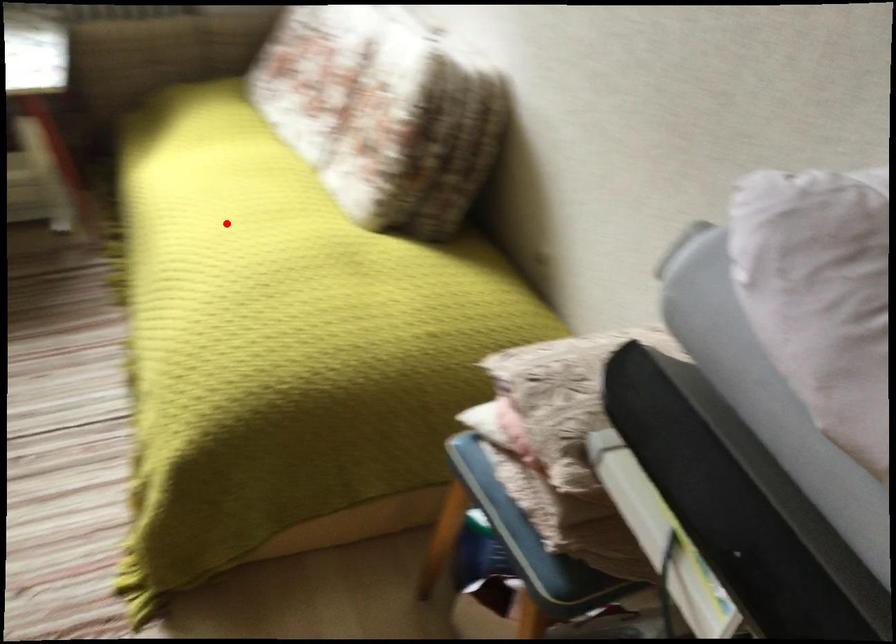
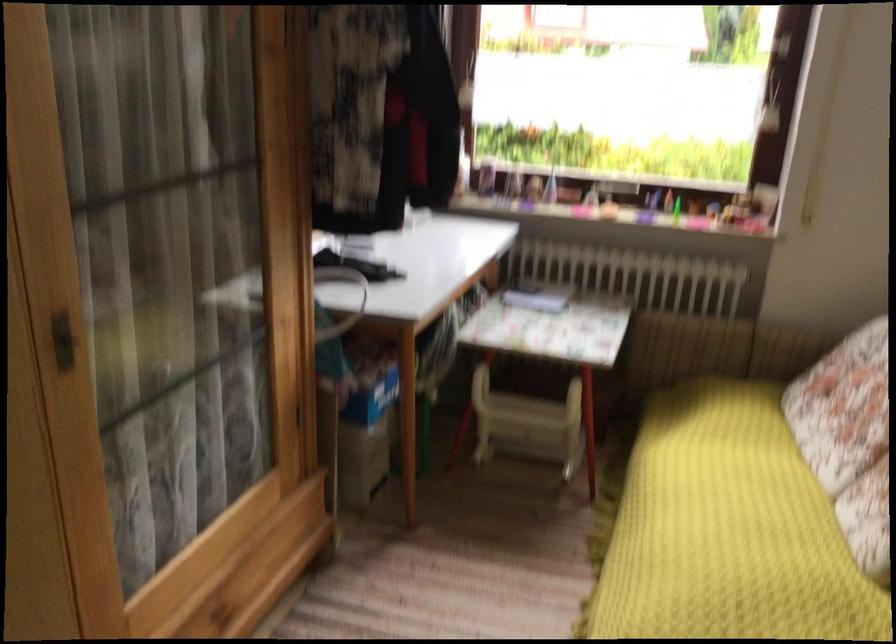
Find the pixel in the second image that matches the highlighted location in the first image.

(728, 529)